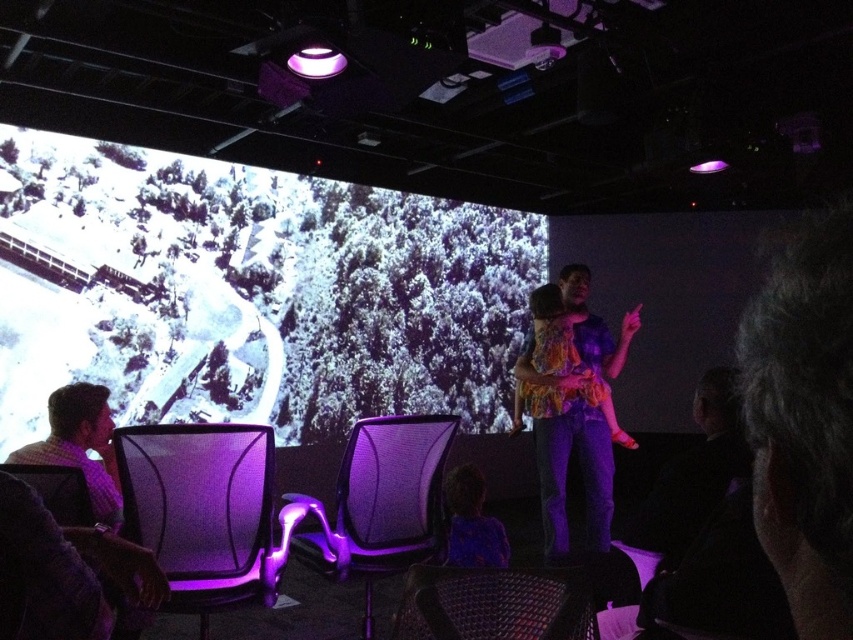
Question: Which point is closer to the camera?

Choices:
 (A) (440, 541)
 (B) (447, 630)
 (C) (556, 490)

Answer: (B)

Question: Observing the image, what is the correct spatial positioning of white matte projection screen at upper left in reference to matte purple dress at lower center?

Choices:
 (A) below
 (B) above

Answer: (B)

Question: Is multicolored fabric shirt at center thinner than purple mesh chair at center?

Choices:
 (A) no
 (B) yes

Answer: (A)

Question: Can you confirm if purple mesh chair at center is smaller than checkered fabric shirt at left?

Choices:
 (A) no
 (B) yes

Answer: (A)

Question: Which object is positioned closest to the multicolored fabric shirt at center?

Choices:
 (A) checkered fabric shirt at left
 (B) mesh fabric chair at lower left
 (C) white matte projection screen at upper left
 (D) woven fabric chair at lower center

Answer: (B)

Question: Which point appears farthest from the camera in this image?

Choices:
 (A) (538, 419)
 (B) (537, 586)
 (C) (489, 518)

Answer: (A)